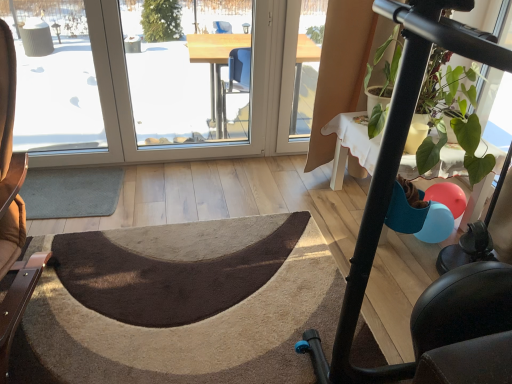
Image resolution: width=512 pixels, height=384 pixels. In order to click on vacant area that lies between white lace tablecloth at upper right and brown textured rug at center, which appears as the 2th doormat when viewed from the top in this screenshot , I will do (302, 220).